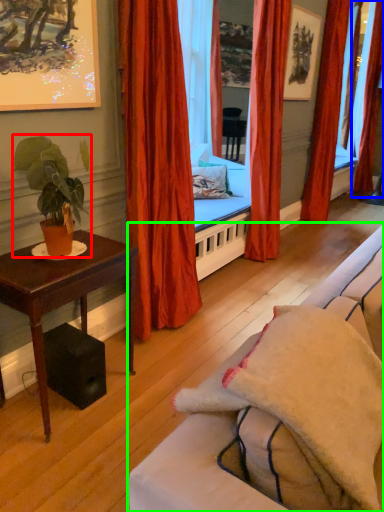
Question: Which object is positioned closest to houseplant (highlighted by a red box)? Select from curtain (highlighted by a blue box) and studio couch (highlighted by a green box).

Choices:
 (A) curtain
 (B) studio couch

Answer: (B)